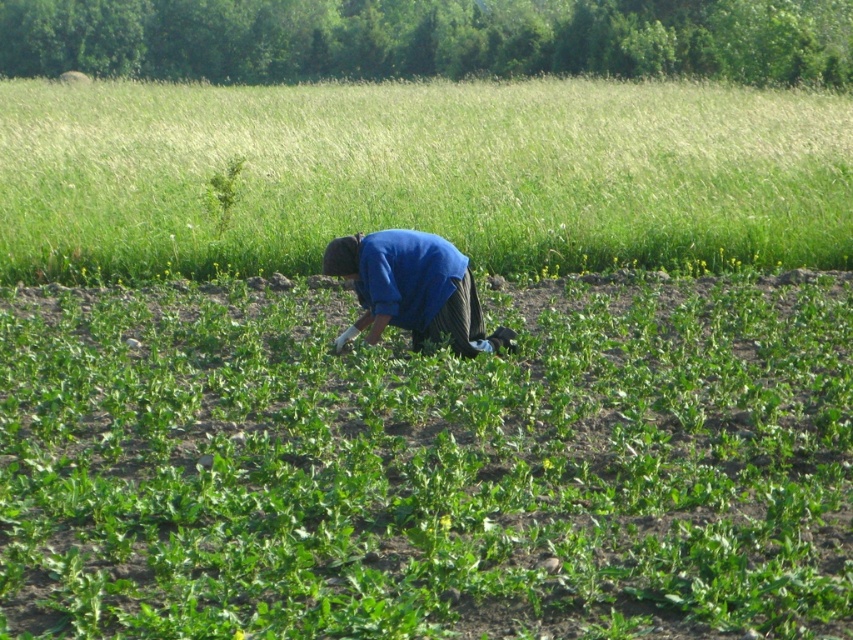
You are a farmer checking the growth of your crops. You notice two items at the center of the field. Which one is bigger in size between the green grass at center and the blue fabric at center?

The green grass at center is larger in size than the blue fabric at center.

You are a farmer who needs to check the growth of crops. You see the green leafy grass at center and the blue fabric at center. Which one is wider?

The green leafy grass at center is wider than the blue fabric at center.